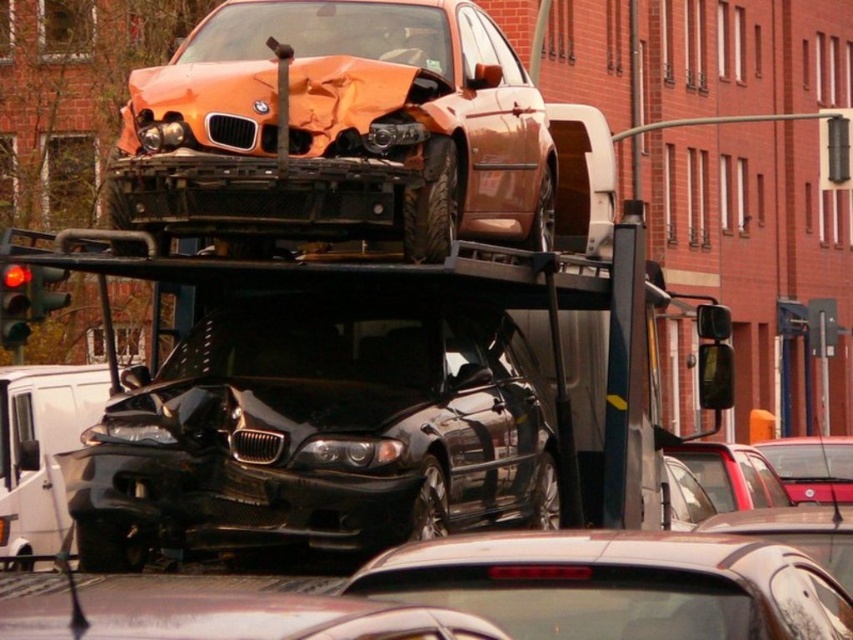
Is point (345, 266) less distant than point (625, 589)?

No.

In the scene shown: Between shiny metallic car at center and shiny brown car at center, which one has less height?

With less height is shiny metallic car at center.

Locate an element on the screen. Image resolution: width=853 pixels, height=640 pixels. shiny metallic car at center is located at coordinates [375, 400].

Locate an element on the screen. Image resolution: width=853 pixels, height=640 pixels. shiny metallic car at center is located at coordinates (375, 400).

How much distance is there between shiny metallic car at center and black glossy sedan at center?

8.12 meters

Between point (305, 401) and point (51, 435), which one is positioned in front?

Point (305, 401) is more forward.

What are the coordinates of `shiny metallic car at center` in the screenshot? It's located at (375, 400).

Identify the location of shiny metallic car at center. The height and width of the screenshot is (640, 853). (375, 400).

Which is more to the right, orange matte car at upper center or metallic red sedan at center?

From the viewer's perspective, metallic red sedan at center appears more on the right side.

Measure the distance between orange matte car at upper center and camera.

orange matte car at upper center is 7.03 meters away from camera.

At what (x,y) coordinates should I click in order to perform the action: click on orange matte car at upper center. Please return your answer as a coordinate pair (x, y). This screenshot has height=640, width=853. Looking at the image, I should click on (339, 129).